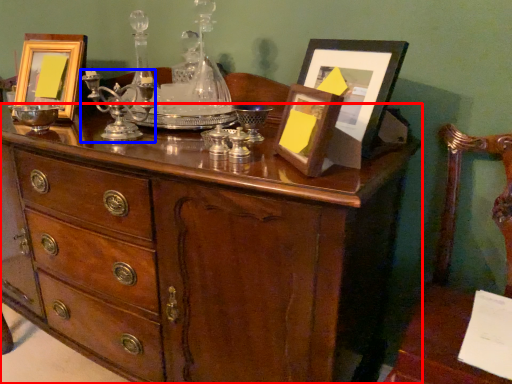
Question: Which point is further to the camera, chest of drawers (highlighted by a red box) or candle holder (highlighted by a blue box)?

Choices:
 (A) chest of drawers
 (B) candle holder

Answer: (B)